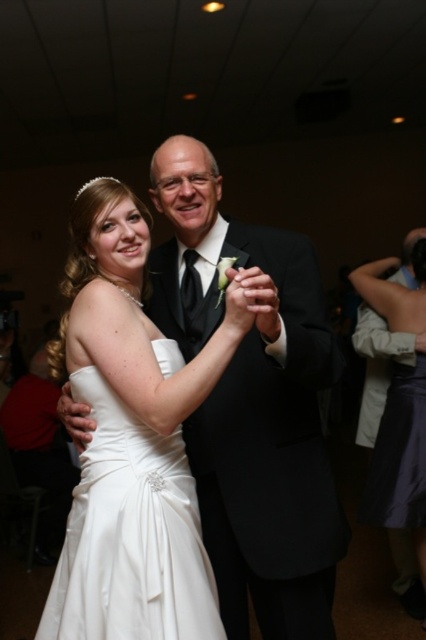
Between point (230, 333) and point (408, 406), which one is positioned behind?

Positioned behind is point (408, 406).

Can you confirm if white satin dress at center is shorter than satin purple dress at lower right?

Yes, white satin dress at center is shorter than satin purple dress at lower right.

This screenshot has height=640, width=426. What do you see at coordinates (132, 442) in the screenshot?
I see `white satin dress at center` at bounding box center [132, 442].

At what (x,y) coordinates should I click in order to perform the action: click on white satin dress at center. Please return your answer as a coordinate pair (x, y). This screenshot has width=426, height=640. Looking at the image, I should click on (132, 442).